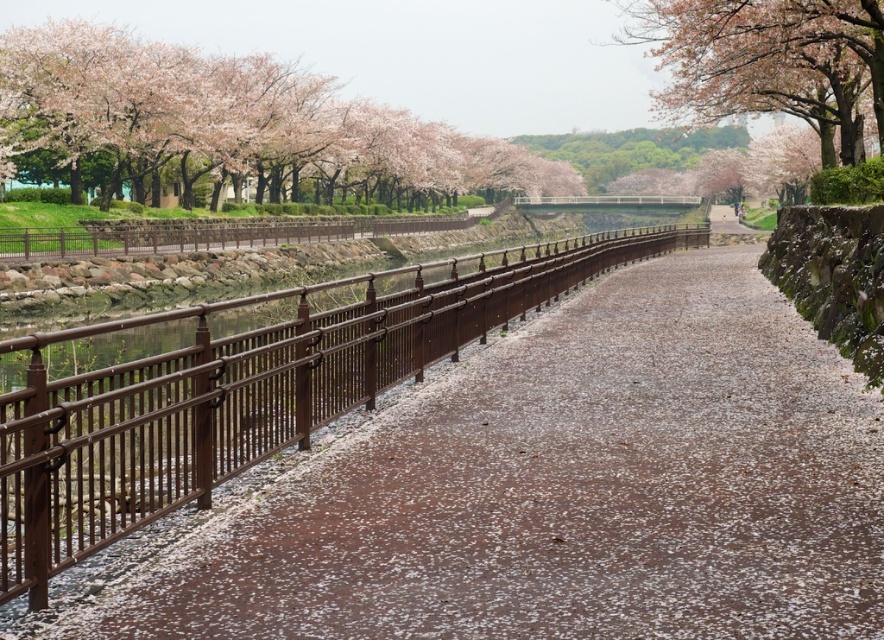
Who is positioned more to the left, brown metallic railing at left or pink blossom tree at upper right?

brown metallic railing at left

Can you confirm if brown metallic railing at left is bigger than pink blossom tree at upper right?

Incorrect, brown metallic railing at left is not larger than pink blossom tree at upper right.

I want to click on brown metallic railing at left, so click(545, 492).

At what (x,y) coordinates should I click in order to perform the action: click on brown metallic railing at left. Please return your answer as a coordinate pair (x, y). The height and width of the screenshot is (640, 884). Looking at the image, I should click on (545, 492).

Between brown metallic railing at left and pink blossoms at upper left, which one has less height?

With less height is brown metallic railing at left.

Looking at this image, who is taller, brown metallic railing at left or pink blossoms at upper left?

With more height is pink blossoms at upper left.

Where is `brown metallic railing at left`? brown metallic railing at left is located at coordinates (545, 492).

Can you confirm if brown metallic railing at left is positioned above white gravel path at center?

No, brown metallic railing at left is not above white gravel path at center.

Between brown metallic railing at left and white gravel path at center, which one appears on the left side from the viewer's perspective?

brown metallic railing at left is more to the left.

Does point (67, 579) come farther from viewer compared to point (711, 228)?

No, (67, 579) is in front of (711, 228).

Identify the location of brown metallic railing at left. (545, 492).